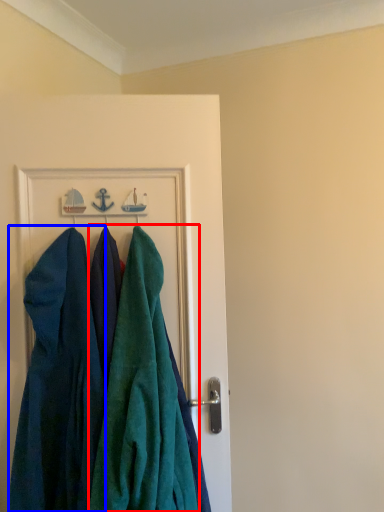
Question: Among these objects, which one is farthest to the camera, towel (highlighted by a red box) or dress (highlighted by a blue box)?

Choices:
 (A) towel
 (B) dress

Answer: (B)